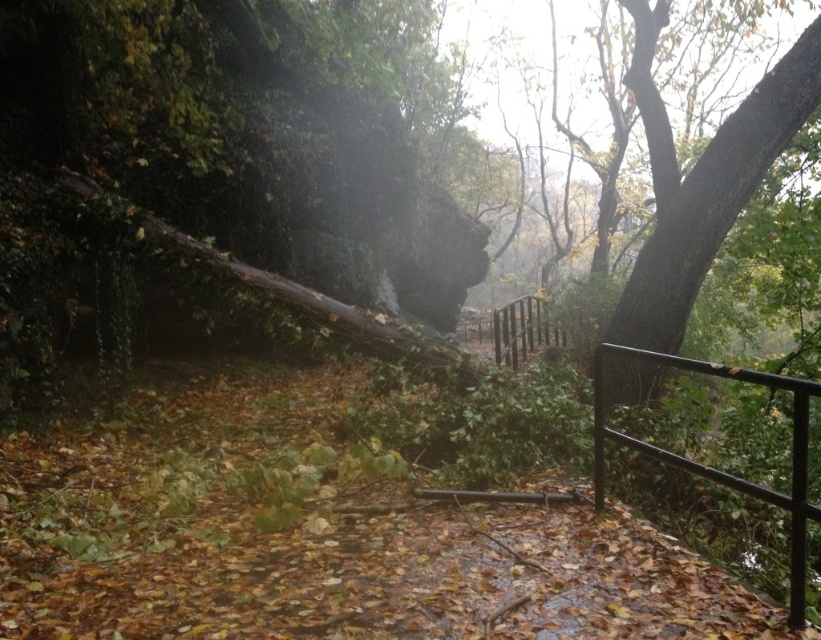
Question: Does brown rough bark tree at upper right have a smaller size compared to black metal fence at right?

Choices:
 (A) yes
 (B) no

Answer: (B)

Question: Which of the following is the farthest from the observer?

Choices:
 (A) (594, 452)
 (B) (742, 140)

Answer: (B)

Question: Can you confirm if brown rough bark tree at upper right is bigger than black metal fence at right?

Choices:
 (A) no
 (B) yes

Answer: (B)

Question: Is brown rough bark tree at upper right bigger than black metal fence at right?

Choices:
 (A) no
 (B) yes

Answer: (B)

Question: Among these objects, which one is farthest from the camera?

Choices:
 (A) black metal fence at right
 (B) brown rough bark tree at upper right

Answer: (B)